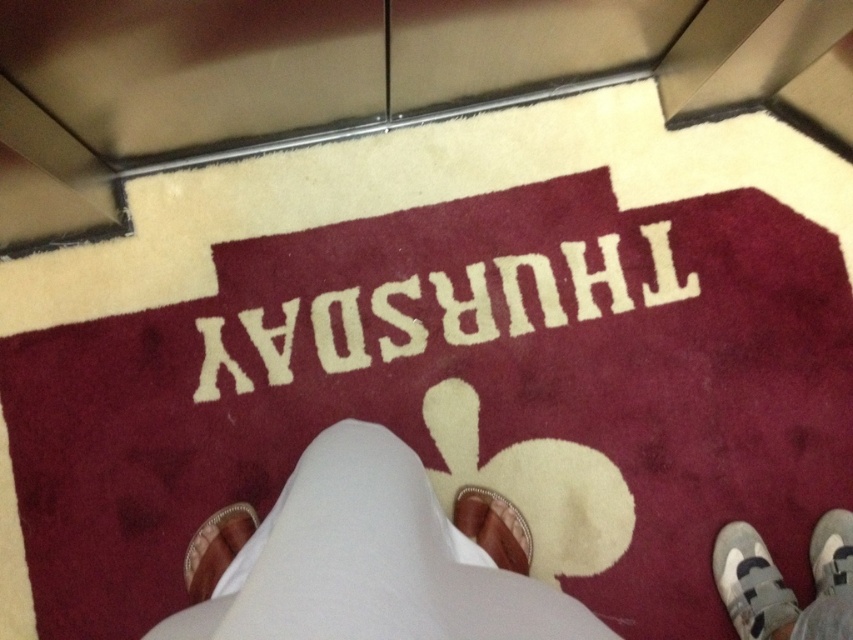
Is point (415, 573) more distant than point (822, 524)?

No, (415, 573) is in front of (822, 524).

Looking at this image, measure the distance between white leather pants at center and camera.

white leather pants at center is 19.43 inches away from camera.

This screenshot has width=853, height=640. What are the coordinates of `white leather pants at center` in the screenshot? It's located at (360, 561).

Is white leather pants at center to the left of white suede shoe at lower right from the viewer's perspective?

Yes, white leather pants at center is to the left of white suede shoe at lower right.

Does point (775, 625) lie behind point (762, 573)?

No, (775, 625) is in front of (762, 573).

What do you see at coordinates (360, 561) in the screenshot? Image resolution: width=853 pixels, height=640 pixels. I see `white leather pants at center` at bounding box center [360, 561].

Locate an element on the screen. white leather pants at center is located at coordinates (x=360, y=561).

Which is behind, point (498, 538) or point (836, 554)?

The point (498, 538) is more distant.

Does brown leather shoe at center have a smaller size compared to white fabric shoe at lower right?

Incorrect, brown leather shoe at center is not smaller in size than white fabric shoe at lower right.

The image size is (853, 640). Find the location of `brown leather shoe at center`. brown leather shoe at center is located at coordinates (492, 525).